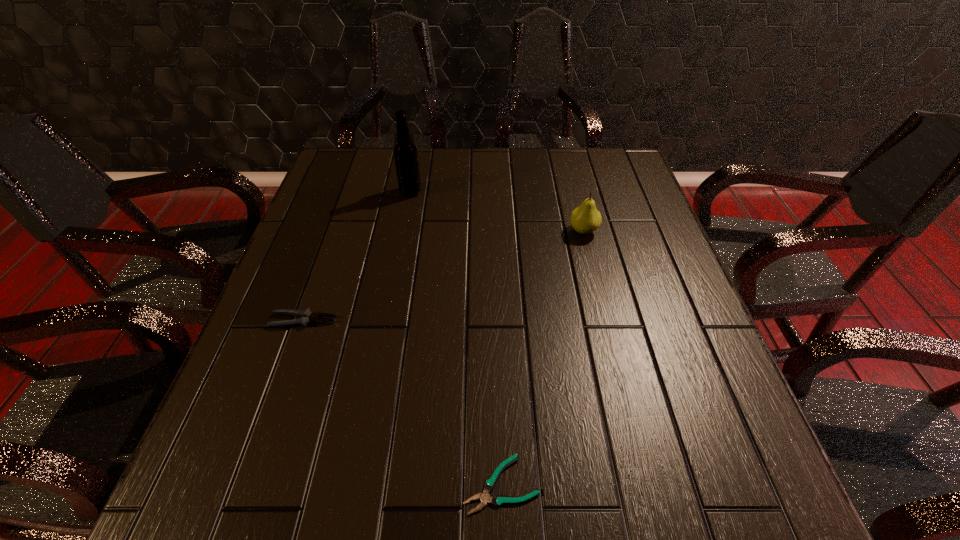
At what (x,y) coordinates should I click in order to perform the action: click on the tallest object. Please return your answer as a coordinate pair (x, y). The image size is (960, 540). Looking at the image, I should click on (405, 153).

Identify the location of beer bottle. This screenshot has height=540, width=960. (405, 153).

This screenshot has height=540, width=960. Find the location of `the rightmost object`. the rightmost object is located at coordinates (585, 219).

Identify the location of pear. (585, 219).

In order to click on the farther pliers in this screenshot , I will do `click(307, 317)`.

Image resolution: width=960 pixels, height=540 pixels. What are the coordinates of `the second nearest object` in the screenshot? It's located at (307, 317).

I want to click on the shortest object, so click(497, 500).

The height and width of the screenshot is (540, 960). I want to click on the shorter pliers, so click(497, 500).

Identify the location of free space located on the right of the tallest object. This screenshot has width=960, height=540. (526, 192).

Locate an element on the screen. vacant space located 0.240m on the back of the pear is located at coordinates (568, 172).